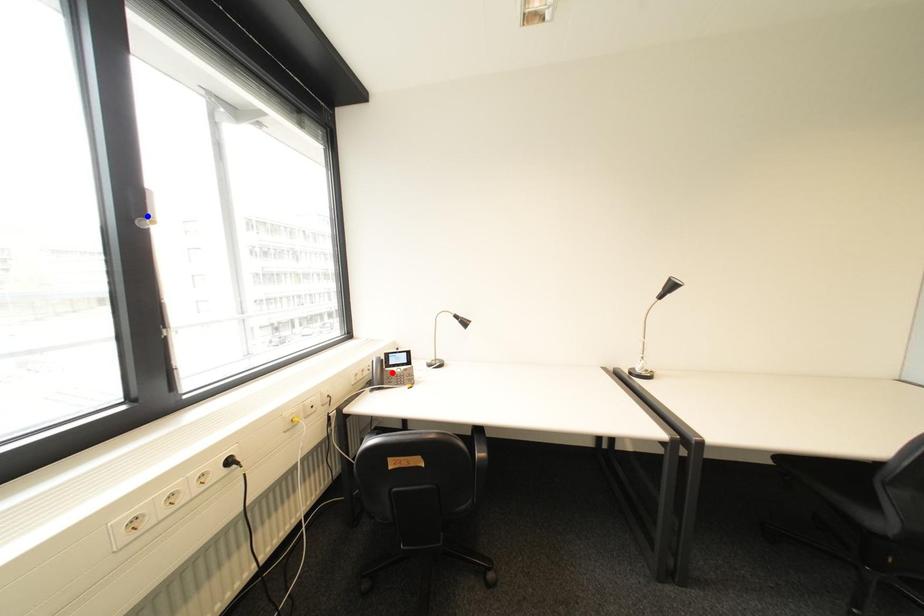
Question: In the image, two points are highlighted. Which point is nearer to the camera? Reply with the corresponding letter.

Choices:
 (A) blue point
 (B) red point

Answer: (A)